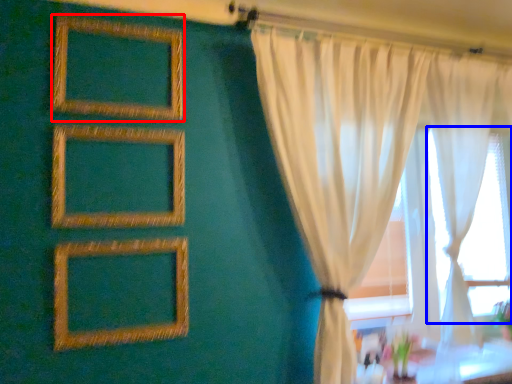
Question: Which point is closer to the camera, picture frame (highlighted by a red box) or bay window (highlighted by a blue box)?

Choices:
 (A) picture frame
 (B) bay window

Answer: (A)